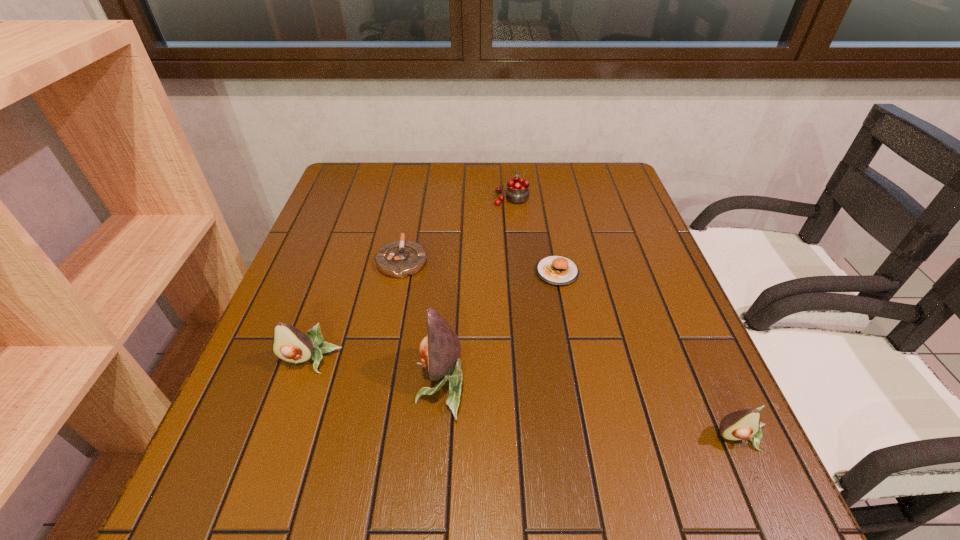
Locate an element on the screen. The image size is (960, 540). vacant area located 0.130m on the seed side of the second avocado from left to right is located at coordinates (349, 384).

Locate an element on the screen. Image resolution: width=960 pixels, height=540 pixels. vacant space located on the seed side of the second avocado from left to right is located at coordinates (265, 384).

Where is `vacant space located on the seed side of the second avocado from left to right`? This screenshot has height=540, width=960. vacant space located on the seed side of the second avocado from left to right is located at coordinates (381, 384).

Where is `vacant region located 0.260m on the left of the food`? The height and width of the screenshot is (540, 960). vacant region located 0.260m on the left of the food is located at coordinates (428, 272).

Find the location of a particular element. vacant region located 0.130m on the handle side of the cherry is located at coordinates (508, 167).

The height and width of the screenshot is (540, 960). Identify the location of vacant space situated 0.120m on the handle side of the cherry. (509, 168).

I want to click on vacant space located 0.050m on the handle side of the cherry, so click(510, 179).

I want to click on blank space located on the left of the fifth object from right to left, so click(300, 260).

In order to click on object that is at the far edge in this screenshot , I will do `click(517, 191)`.

The height and width of the screenshot is (540, 960). In order to click on object that is at the left edge in this screenshot , I will do `click(289, 344)`.